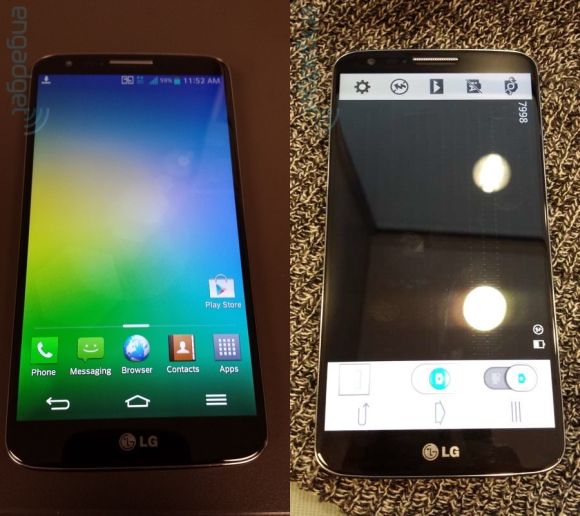
The image size is (580, 516). In order to click on brown table top in this screenshot , I will do `click(260, 229)`.